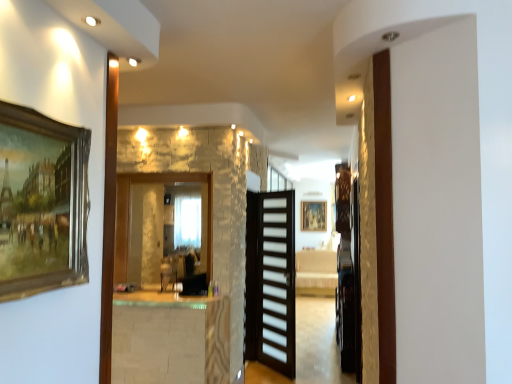
Question: Choose the correct answer: Is wooden picture frame at left inside black matte door at center or outside it?

Choices:
 (A) inside
 (B) outside

Answer: (B)

Question: From a real-world perspective, relative to black matte door at center, is wooden picture frame at left vertically above or below?

Choices:
 (A) below
 (B) above

Answer: (B)

Question: Which object is the closest to the wooden picture frame at left?

Choices:
 (A) white marble table at center
 (B) black matte door at center
 (C) clear glass mirror at center

Answer: (A)

Question: Which object is the closest to the clear glass mirror at center?

Choices:
 (A) black matte door at center
 (B) wooden picture frame at left
 (C) white marble table at center

Answer: (C)